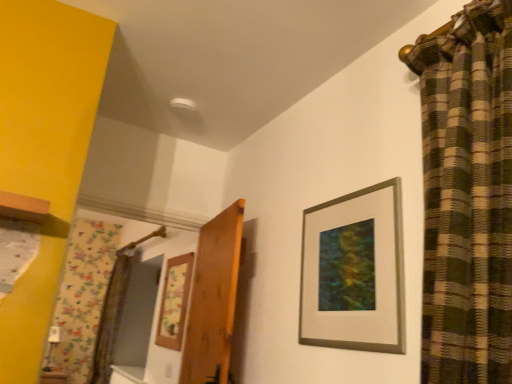
Locate an element on the screen. The width and height of the screenshot is (512, 384). silver/metallic picture frame at upper right, which is the second picture frame from back to front is located at coordinates pyautogui.click(x=368, y=269).

This screenshot has width=512, height=384. What are the coordinates of `wooden door at center` in the screenshot? It's located at (213, 299).

At what (x,y) coordinates should I click in order to perform the action: click on silver/metallic picture frame at upper right, which is counted as the second picture frame, starting from the left. Please return your answer as a coordinate pair (x, y). This screenshot has height=384, width=512. Looking at the image, I should click on (368, 269).

Which object is positioned more to the left, wooden door at center or silver/metallic picture frame at upper right, positioned as the 1th picture frame in right-to-left order?

wooden door at center.

Is wooden door at center oriented away from silver/metallic picture frame at upper right, the second picture frame in the bottom-to-top sequence?

No, silver/metallic picture frame at upper right, the second picture frame in the bottom-to-top sequence, is not at the back of wooden door at center.

Considering the points (220, 359) and (365, 189), which point is in front, point (220, 359) or point (365, 189)?

Positioned in front is point (365, 189).

Considering the positions of objects wooden door at center and silver/metallic picture frame at upper right, which is counted as the second picture frame, starting from the left, in the image provided, who is behind, wooden door at center or silver/metallic picture frame at upper right, which is counted as the second picture frame, starting from the left,?

wooden door at center is further away from the camera.

Locate an element on the screen. Image resolution: width=512 pixels, height=384 pixels. picture frame in front of the wooden picture frame at center, which is the second picture frame from right to left is located at coordinates (368, 269).

Based on the photo, who is shorter, silver/metallic picture frame at upper right, which is counted as the second picture frame, starting from the left, or wooden picture frame at center, the second picture frame in the front-to-back sequence?

silver/metallic picture frame at upper right, which is counted as the second picture frame, starting from the left, is shorter.

Is silver/metallic picture frame at upper right, placed as the 1th picture frame when sorted from top to bottom, aimed at wooden picture frame at center, acting as the first picture frame starting from the back?

No, silver/metallic picture frame at upper right, placed as the 1th picture frame when sorted from top to bottom, does not turn towards wooden picture frame at center, acting as the first picture frame starting from the back.

What's the angular difference between silver/metallic picture frame at upper right, the second picture frame in the bottom-to-top sequence, and wooden picture frame at center, the second picture frame in the front-to-back sequence,'s facing directions?

0.635 degrees separate the facing orientations of silver/metallic picture frame at upper right, the second picture frame in the bottom-to-top sequence, and wooden picture frame at center, the second picture frame in the front-to-back sequence.

Considering the sizes of objects wooden picture frame at center, placed as the first picture frame when sorted from left to right, and wooden door at center in the image provided, who is thinner, wooden picture frame at center, placed as the first picture frame when sorted from left to right, or wooden door at center?

Thinner between the two is wooden picture frame at center, placed as the first picture frame when sorted from left to right.

Consider the image. Between wooden picture frame at center, which is counted as the 1th picture frame, starting from the bottom, and wooden door at center, which one has less height?

Standing shorter between the two is wooden picture frame at center, which is counted as the 1th picture frame, starting from the bottom.

At what (x,y) coordinates should I click in order to perform the action: click on door lying on the right of wooden picture frame at center, the second picture frame viewed from the top. Please return your answer as a coordinate pair (x, y). The height and width of the screenshot is (384, 512). Looking at the image, I should click on coord(213,299).

Is wooden picture frame at center, the second picture frame viewed from the top, at the left side of wooden door at center?

Yes, wooden picture frame at center, the second picture frame viewed from the top, is to the left of wooden door at center.

Is silver/metallic picture frame at upper right, positioned as the 1th picture frame in right-to-left order, situated inside wooden door at center or outside?

silver/metallic picture frame at upper right, positioned as the 1th picture frame in right-to-left order, is not inside wooden door at center, it's outside.

Considering the positions of point (308, 314) and point (236, 267), is point (308, 314) closer or farther from the camera than point (236, 267)?

Clearly, point (308, 314) is closer to the camera than point (236, 267).

From a real-world perspective, is silver/metallic picture frame at upper right, placed as the 1th picture frame when sorted from top to bottom, physically located above or below wooden door at center?

From a real-world perspective, silver/metallic picture frame at upper right, placed as the 1th picture frame when sorted from top to bottom, is physically above wooden door at center.

Is wooden door at center at the back of silver/metallic picture frame at upper right, which is the second picture frame from back to front?

No, wooden door at center is not at the back of silver/metallic picture frame at upper right, which is the second picture frame from back to front.

Does wooden door at center have a lesser height compared to wooden picture frame at center, the second picture frame viewed from the top?

In fact, wooden door at center may be taller than wooden picture frame at center, the second picture frame viewed from the top.

Could you tell me if wooden door at center is turned towards wooden picture frame at center, acting as the first picture frame starting from the back?

No, wooden door at center is not aimed at wooden picture frame at center, acting as the first picture frame starting from the back.

Which of these two, wooden door at center or wooden picture frame at center, the second picture frame in the front-to-back sequence, is smaller?

With smaller size is wooden picture frame at center, the second picture frame in the front-to-back sequence.

Is wooden picture frame at center, which is the second picture frame from right to left, at the left side of silver/metallic picture frame at upper right, which is counted as the second picture frame, starting from the left?

Yes, wooden picture frame at center, which is the second picture frame from right to left, is to the left of silver/metallic picture frame at upper right, which is counted as the second picture frame, starting from the left.

From a real-world perspective, relative to silver/metallic picture frame at upper right, which is the second picture frame from back to front, is wooden picture frame at center, acting as the first picture frame starting from the back, vertically above or below?

wooden picture frame at center, acting as the first picture frame starting from the back, is situated lower than silver/metallic picture frame at upper right, which is the second picture frame from back to front, in the real world.

Considering the relative positions of wooden picture frame at center, placed as the first picture frame when sorted from left to right, and silver/metallic picture frame at upper right, which is the second picture frame from back to front, in the image provided, is wooden picture frame at center, placed as the first picture frame when sorted from left to right, in front of silver/metallic picture frame at upper right, which is the second picture frame from back to front,?

No, wooden picture frame at center, placed as the first picture frame when sorted from left to right, is further to the viewer.

What's the angular difference between wooden picture frame at center, placed as the first picture frame when sorted from left to right, and silver/metallic picture frame at upper right, the second picture frame in the bottom-to-top sequence,'s facing directions?

There is a 0.635-degree angle between the facing directions of wooden picture frame at center, placed as the first picture frame when sorted from left to right, and silver/metallic picture frame at upper right, the second picture frame in the bottom-to-top sequence.

This screenshot has height=384, width=512. Find the location of `door behind the silver/metallic picture frame at upper right, the second picture frame in the bottom-to-top sequence`. door behind the silver/metallic picture frame at upper right, the second picture frame in the bottom-to-top sequence is located at coordinates (213, 299).

Where is `picture frame below the silver/metallic picture frame at upper right, positioned as the 1th picture frame in right-to-left order (from the image's perspective)`? Image resolution: width=512 pixels, height=384 pixels. picture frame below the silver/metallic picture frame at upper right, positioned as the 1th picture frame in right-to-left order (from the image's perspective) is located at coordinates (174, 302).

When comparing their distances from wooden door at center, does silver/metallic picture frame at upper right, the first picture frame viewed from the front, or wooden picture frame at center, the second picture frame in the front-to-back sequence, seem closer?

silver/metallic picture frame at upper right, the first picture frame viewed from the front, is positioned closer to the anchor wooden door at center.

Considering their positions, is wooden picture frame at center, placed as the first picture frame when sorted from left to right, positioned further to silver/metallic picture frame at upper right, the second picture frame in the bottom-to-top sequence, than wooden door at center?

wooden picture frame at center, placed as the first picture frame when sorted from left to right, is further to silver/metallic picture frame at upper right, the second picture frame in the bottom-to-top sequence.

When comparing their distances from wooden picture frame at center, which is counted as the 1th picture frame, starting from the bottom, does wooden door at center or silver/metallic picture frame at upper right, positioned as the 1th picture frame in right-to-left order, seem closer?

wooden door at center lies closer to wooden picture frame at center, which is counted as the 1th picture frame, starting from the bottom, than the other object.

Looking at the image, which one is located closer to wooden door at center, wooden picture frame at center, which is counted as the 1th picture frame, starting from the bottom, or silver/metallic picture frame at upper right, placed as the 1th picture frame when sorted from top to bottom?

Based on the image, silver/metallic picture frame at upper right, placed as the 1th picture frame when sorted from top to bottom, appears to be nearer to wooden door at center.

From the image, which object appears to be nearer to wooden picture frame at center, the second picture frame viewed from the top, silver/metallic picture frame at upper right, which is the second picture frame from back to front, or wooden door at center?

Based on the image, wooden door at center appears to be nearer to wooden picture frame at center, the second picture frame viewed from the top.

Based on the photo, which object lies nearer to the anchor point silver/metallic picture frame at upper right, the second picture frame in the bottom-to-top sequence, wooden door at center or wooden picture frame at center, the second picture frame viewed from the top?

wooden door at center is closer to silver/metallic picture frame at upper right, the second picture frame in the bottom-to-top sequence.

Where is `door between silver/metallic picture frame at upper right, the second picture frame in the bottom-to-top sequence, and wooden picture frame at center, the second picture frame in the front-to-back sequence, along the z-axis`? Image resolution: width=512 pixels, height=384 pixels. door between silver/metallic picture frame at upper right, the second picture frame in the bottom-to-top sequence, and wooden picture frame at center, the second picture frame in the front-to-back sequence, along the z-axis is located at coordinates (213, 299).